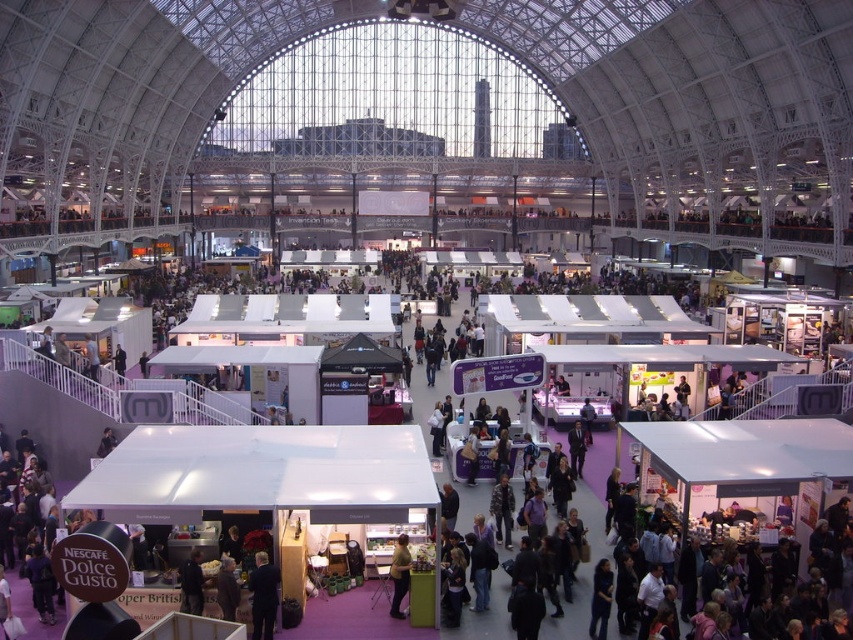
You are a photographer at the exhibition hall and want to capture both the dark blue suit at lower center and the matte yellow shirt at center in a single frame. Given their sizes, which one might you need to position closer to the camera to ensure both fit well in the photo?

The dark blue suit at lower center is wider than the matte yellow shirt at center. To ensure both fit well in the photo, you should position the matte yellow shirt at center closer to the camera since it is narrower and requires less space in the frame.

You are attending a trade show and see two attendees wearing distinct clothing items. One is wearing a dark blue suit at lower center, and the other has a matte yellow shirt at center. From your perspective standing at the entrance, which clothing item is located to the left of the other?

The dark blue suit at lower center is positioned on the left side of matte yellow shirt at center.

You are standing in the exhibition hall and want to reach a specific point in the hall. The point you need to reach is located at point coordinates point (x=267, y=589). Given that you can walk at a speed of 3 feet per second, how many seconds will it take you to reach that point?

The distance of point (x=267, y=589) from viewer is 141.74 feet. At a speed of 3 feet per second, it will take approximately 141.74 divided by 3 equals 47.25 seconds. So, it will take about 47.25 seconds to reach the point.